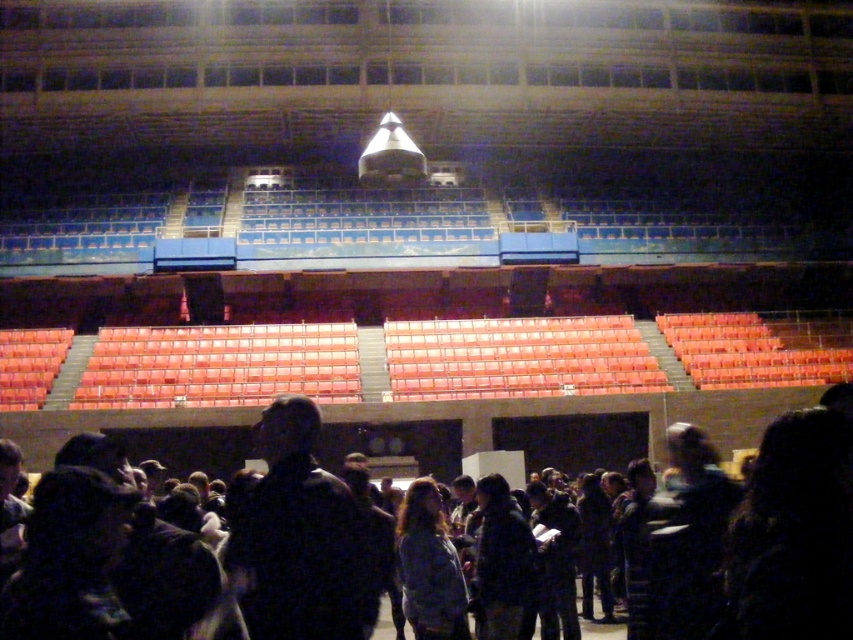
Is dark matte jacket at center below dark clothing at center?

Actually, dark matte jacket at center is above dark clothing at center.

Between dark matte jacket at center and dark clothing at center, which one is positioned higher?

dark matte jacket at center is above.

Is point (314, 474) less distant than point (724, 438)?

Yes, it is.

Where is `dark matte jacket at center`? The image size is (853, 640). dark matte jacket at center is located at coordinates (300, 538).